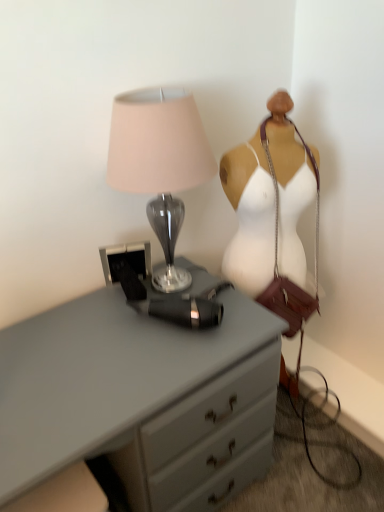
Question: From the image's perspective, is white fabric mannequin at right located beneath satin gray lamp at upper left?

Choices:
 (A) yes
 (B) no

Answer: (A)

Question: Does white fabric mannequin at right have a larger size compared to satin gray lamp at upper left?

Choices:
 (A) no
 (B) yes

Answer: (B)

Question: Considering the relative sizes of white fabric mannequin at right and satin gray lamp at upper left in the image provided, is white fabric mannequin at right thinner than satin gray lamp at upper left?

Choices:
 (A) yes
 (B) no

Answer: (A)

Question: Can you confirm if white fabric mannequin at right is wider than satin gray lamp at upper left?

Choices:
 (A) yes
 (B) no

Answer: (B)

Question: Is white fabric mannequin at right not close to satin gray lamp at upper left?

Choices:
 (A) no
 (B) yes

Answer: (A)

Question: From a real-world perspective, is white fabric mannequin at right on satin gray lamp at upper left?

Choices:
 (A) no
 (B) yes

Answer: (A)

Question: From a real-world perspective, is matte gray chest of drawers at center positioned over white fabric mannequin at right based on gravity?

Choices:
 (A) no
 (B) yes

Answer: (A)

Question: Is white fabric mannequin at right a part of matte gray chest of drawers at center?

Choices:
 (A) no
 (B) yes

Answer: (A)

Question: Considering the relative sizes of matte gray chest of drawers at center and white fabric mannequin at right in the image provided, is matte gray chest of drawers at center taller than white fabric mannequin at right?

Choices:
 (A) no
 (B) yes

Answer: (A)

Question: Is white fabric mannequin at right at the back of matte gray chest of drawers at center?

Choices:
 (A) yes
 (B) no

Answer: (B)

Question: Does matte gray chest of drawers at center come in front of white fabric mannequin at right?

Choices:
 (A) no
 (B) yes

Answer: (B)

Question: Considering the relative sizes of matte gray chest of drawers at center and white fabric mannequin at right in the image provided, is matte gray chest of drawers at center shorter than white fabric mannequin at right?

Choices:
 (A) no
 (B) yes

Answer: (B)

Question: From a real-world perspective, is white fabric mannequin at right on matte gray chest of drawers at center?

Choices:
 (A) no
 (B) yes

Answer: (B)